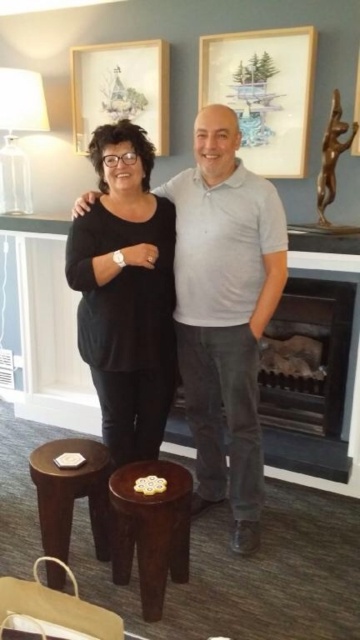
Can you confirm if matte black shirt at center is bigger than matte wooden picture frame at upper center?

Yes.

Does matte black shirt at center have a lesser height compared to matte wooden picture frame at upper center?

Incorrect, matte black shirt at center's height does not fall short of matte wooden picture frame at upper center's.

At what (x,y) coordinates should I click in order to perform the action: click on matte black shirt at center. Please return your answer as a coordinate pair (x, y). This screenshot has width=360, height=640. Looking at the image, I should click on (225, 310).

At what (x,y) coordinates should I click in order to perform the action: click on matte black shirt at center. Please return your answer as a coordinate pair (x, y). The image size is (360, 640). Looking at the image, I should click on (225, 310).

Is black matte shirt at center bigger than matte wooden picture frame at upper center?

Indeed, black matte shirt at center has a larger size compared to matte wooden picture frame at upper center.

Is point (108, 214) positioned behind point (133, 112)?

No, it is not.

Identify the location of black matte shirt at center. Image resolution: width=360 pixels, height=640 pixels. (125, 292).

Where is `black matte shirt at center`? black matte shirt at center is located at coordinates (125, 292).

Does dark brown wooden stool at center appear on the left side of matte wooden picture frame at upper center?

Incorrect, dark brown wooden stool at center is not on the left side of matte wooden picture frame at upper center.

At what (x,y) coordinates should I click in order to perform the action: click on dark brown wooden stool at center. Please return your answer as a coordinate pair (x, y). This screenshot has width=360, height=640. Looking at the image, I should click on (150, 531).

Locate an element on the screen. The image size is (360, 640). dark brown wooden stool at center is located at coordinates (150, 531).